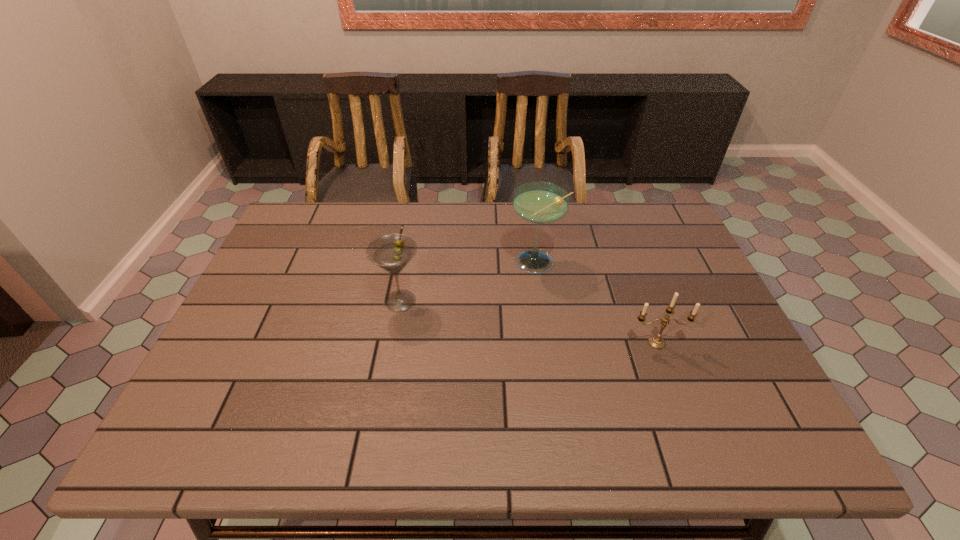
You are a GUI agent. You are given a task and a screenshot of the screen. Output one action in this format:
    pyautogui.click(x=<x>, y=<y>)
    Task: Click on the unoccupied position between the farthest object and the left martini
    
    Given the screenshot: What is the action you would take?
    pyautogui.click(x=468, y=282)

This screenshot has height=540, width=960. What are the coordinates of `free area in between the nearer martini and the shortest object` in the screenshot? It's located at (529, 322).

Locate an element on the screen. This screenshot has width=960, height=540. free space between the farther martini and the second farthest object is located at coordinates (468, 282).

I want to click on free space between the right martini and the shortest object, so click(596, 303).

Find the location of a particular element. This screenshot has width=960, height=540. empty space between the shortest object and the right martini is located at coordinates (596, 303).

The height and width of the screenshot is (540, 960). I want to click on object that is the second closest one to the second tallest object, so click(x=656, y=342).

The height and width of the screenshot is (540, 960). In order to click on the second closest object to the shortest object in this screenshot , I will do `click(392, 252)`.

In order to click on free space that satisfies the following two spatial constraints: 1. on the front side of the leftmost object; 2. on the right side of the candle in this screenshot , I will do `click(393, 343)`.